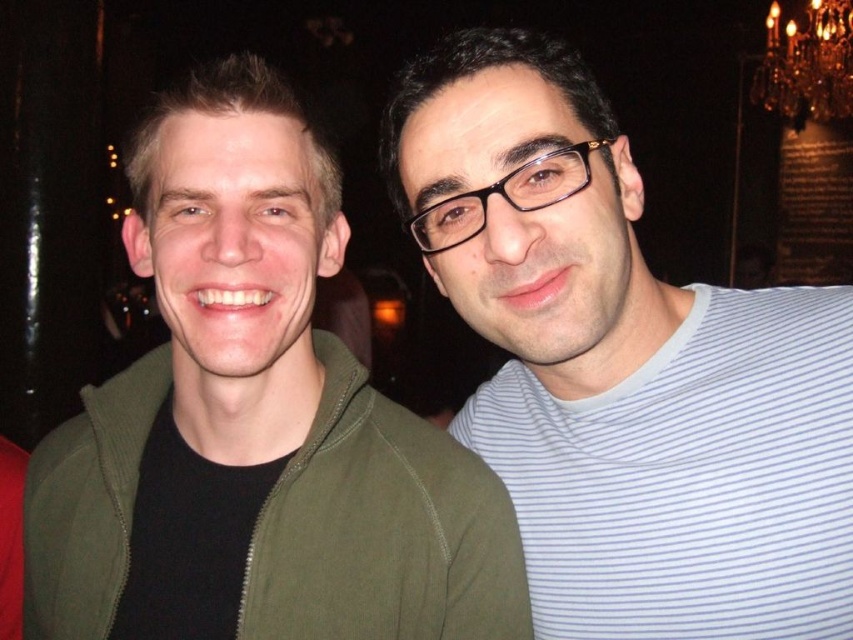
Question: Which point is closer to the camera taking this photo?

Choices:
 (A) (747, 440)
 (B) (833, 426)
 (C) (152, 358)
 (D) (837, 68)

Answer: (B)

Question: Can you confirm if green matte jacket at left is smaller than white striped t-shirt at right?

Choices:
 (A) no
 (B) yes

Answer: (A)

Question: Does striped cotton shirt at right lie behind gold crystal chandelier at upper right?

Choices:
 (A) no
 (B) yes

Answer: (A)

Question: Is striped cotton shirt at right bigger than white striped t-shirt at right?

Choices:
 (A) no
 (B) yes

Answer: (B)

Question: Which object is closer to the camera taking this photo?

Choices:
 (A) green matte jacket at left
 (B) white striped t-shirt at right
 (C) striped cotton shirt at right
 (D) gold crystal chandelier at upper right

Answer: (A)

Question: Which is farther from the gold crystal chandelier at upper right?

Choices:
 (A) white striped t-shirt at right
 (B) striped cotton shirt at right

Answer: (B)